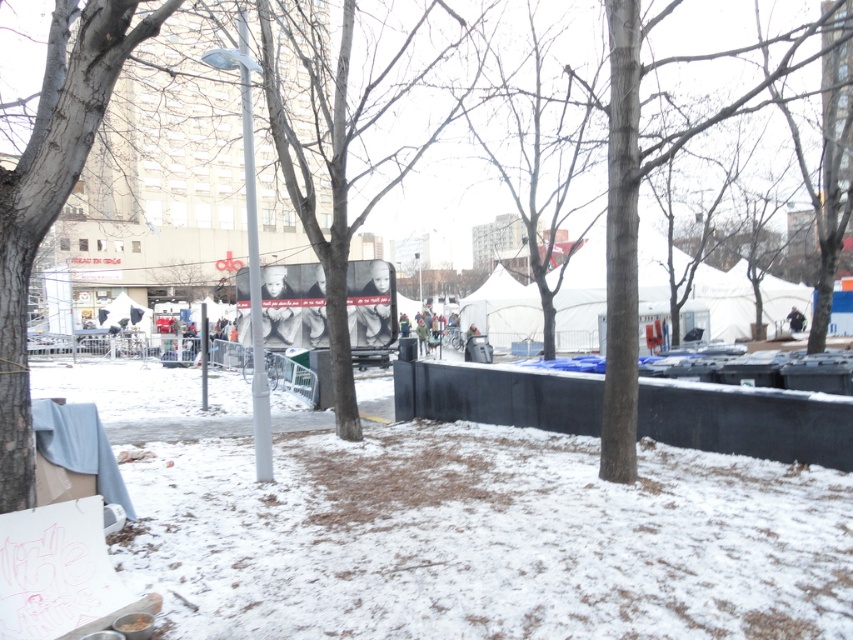
You are standing at the edge of the paved area in the foreground of the image. You see two points marked on the ground. The first point is at coordinate point (409, 83) and the second is at point (6, 243). If you want to reach the point that is closer to you, which coordinate should you walk towards?

You should walk towards point (6, 243) because it is closer to you than point (409, 83), which is further away.

You are standing at the edge of the paved area in the scene. Which direction should you walk to reach the smooth gray tree at center?

The smooth gray tree at center is located at coordinates 0.212 on the x axis and 0.413 on the y axis. Since you are at the edge of the paved area, you should walk towards the center of the image to reach it.

You are standing in the snowy plaza and see the smooth gray tree at center and the gray bark tree at left. Which tree is positioned more to the right side of the image?

The smooth gray tree at center is positioned to the right of the gray bark tree at left, so it is more to the right side of the image.